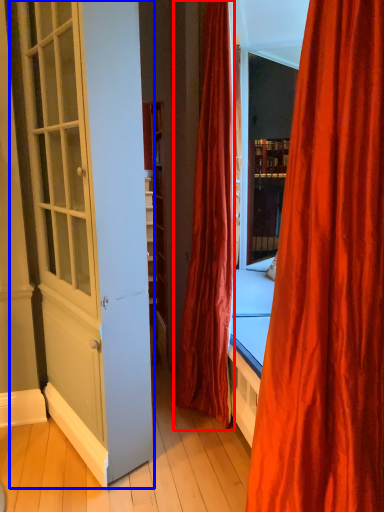
Question: Which of the following is the closest to the observer, curtain (highlighted by a red box) or screen door (highlighted by a blue box)?

Choices:
 (A) curtain
 (B) screen door

Answer: (B)